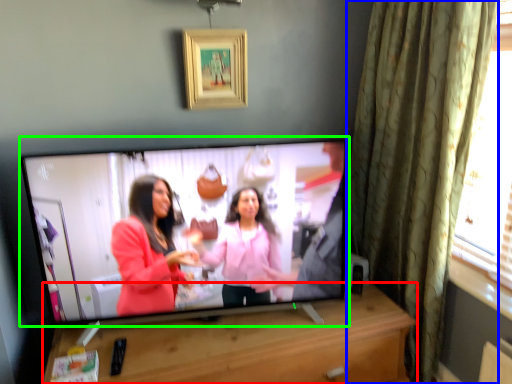
Question: Estimate the real-world distances between objects in this image. Which object is closer to furniture (highlighted by a red box), curtain (highlighted by a blue box) or television (highlighted by a green box)?

Choices:
 (A) curtain
 (B) television

Answer: (B)